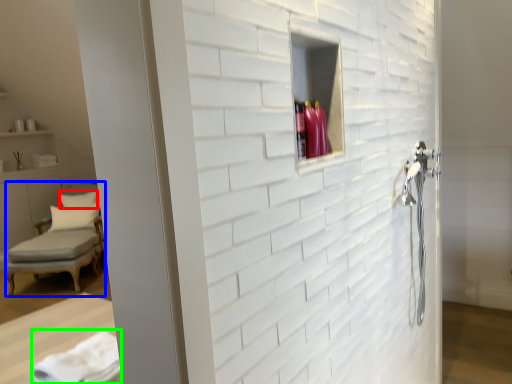
Question: Based on their relative distances, which object is farther from pillow (highlighted by a red box)? Choose from chair (highlighted by a blue box) and bath towel (highlighted by a green box).

Choices:
 (A) chair
 (B) bath towel

Answer: (B)